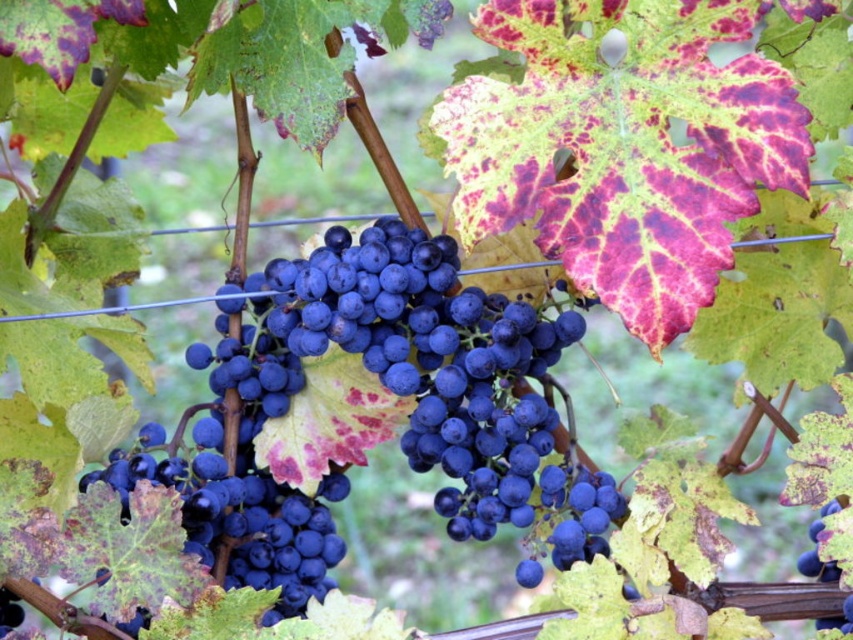
Question: Is the position of shiny dark blue grapes at center more distant than that of blue matte grape at center?

Choices:
 (A) yes
 (B) no

Answer: (B)

Question: Which point is closer to the camera?

Choices:
 (A) (177, 465)
 (B) (824, 506)

Answer: (B)

Question: Which of the following is the farthest from the observer?

Choices:
 (A) shiny dark blue grapes at center
 (B) blue matte grape at center

Answer: (B)

Question: In this image, where is shiny dark blue grapes at center located relative to blue matte grape at center?

Choices:
 (A) left
 (B) right

Answer: (A)

Question: Can you confirm if shiny dark blue grapes at center is wider than blue matte grape at center?

Choices:
 (A) no
 (B) yes

Answer: (B)

Question: Which point is farther to the camera?

Choices:
 (A) blue matte grape at center
 (B) shiny dark blue grapes at center

Answer: (A)